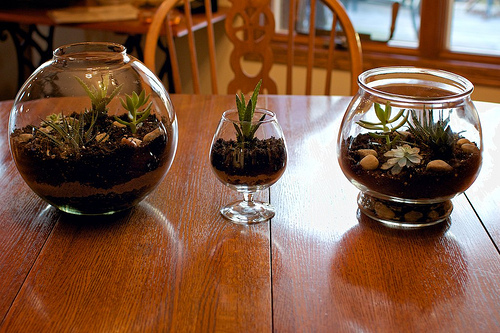
You are a GUI agent. You are given a task and a screenshot of the screen. Output one action in this format:
    pyautogui.click(x=<x>, y=<y>)
    Task: Click on the rocks in terrariums
    
    Given the screenshot: What is the action you would take?
    pyautogui.click(x=24, y=133), pyautogui.click(x=132, y=139), pyautogui.click(x=157, y=130), pyautogui.click(x=365, y=161), pyautogui.click(x=365, y=151), pyautogui.click(x=440, y=166), pyautogui.click(x=470, y=147), pyautogui.click(x=464, y=140)